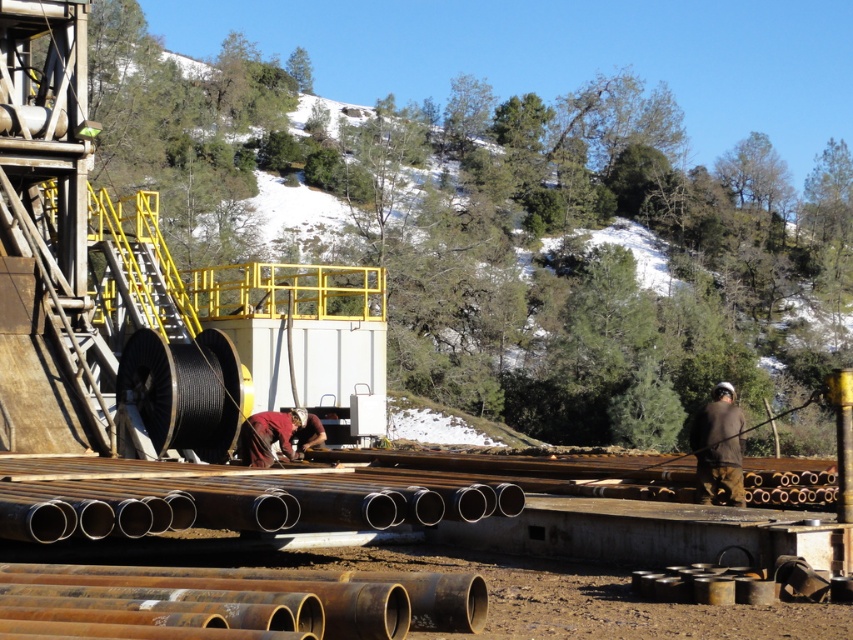
Does polished metallic pipes at center appear under maroon fabric shirt at center?

Yes.

Between polished metallic pipes at center and maroon fabric shirt at center, which one appears on the left side from the viewer's perspective?

From the viewer's perspective, maroon fabric shirt at center appears more on the left side.

Identify the location of polished metallic pipes at center. (234, 506).

Does point (709, 406) lie in front of point (253, 464)?

That is True.

Which is more to the right, brown fabric jacket at right or maroon fabric shirt at center?

brown fabric jacket at right is more to the right.

This screenshot has height=640, width=853. I want to click on brown fabric jacket at right, so click(x=718, y=445).

Can you confirm if polished metallic pipes at center is positioned above brown fabric jacket at right?

Yes.

Can you confirm if polished metallic pipes at center is wider than brown fabric jacket at right?

Incorrect, polished metallic pipes at center's width does not surpass brown fabric jacket at right's.

Describe the element at coordinates (234, 506) in the screenshot. I see `polished metallic pipes at center` at that location.

This screenshot has width=853, height=640. I want to click on polished metallic pipes at center, so click(234, 506).